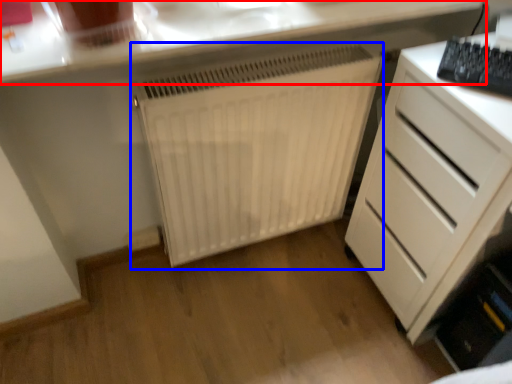
Question: Which point is closer to the camera, countertop (highlighted by a red box) or radiator (highlighted by a blue box)?

Choices:
 (A) countertop
 (B) radiator

Answer: (A)